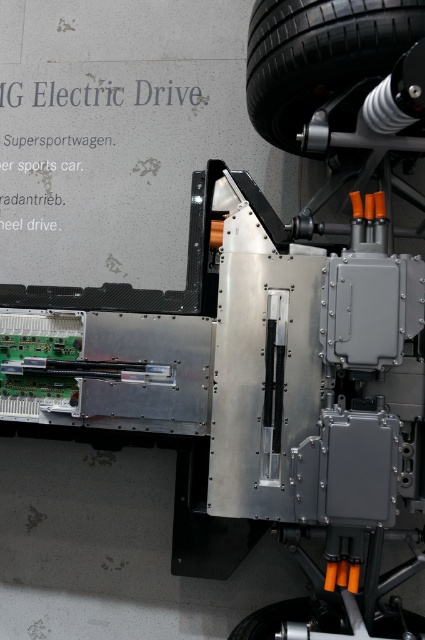
Please provide the 2D coordinates of the black rubber tire at upper right in the image. The coordinates should be in the format of a point with two decimal places, like point x, y.

The 2D coordinates of the black rubber tire at upper right are point (319,54).